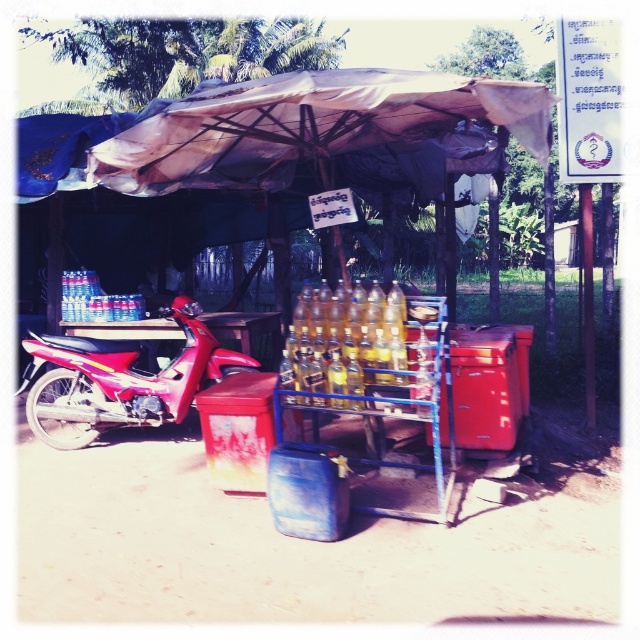
You are a customer approaching the stall and want to reach the metallic blue cart at center to buy something. However, there is a metallic red motorcycle at left blocking your path. Can you walk around the motorcycle to reach the cart?

The metallic blue cart at center is closer to the viewer than the metallic red motorcycle at left, so you can walk around the motorcycle to reach the cart.

You are standing in front of the stall and want to place a small item on the nearest point between point (344, 358) and point (86, 410). Which point should you choose?

Point (344, 358) is closer to the camera than point (86, 410), so you should choose point (344, 358) to place the item.

You are a customer at the stall and want to pick up the yellow glass bottles at center. Which direction should you move from the metallic red motorcycle at left to reach them?

The yellow glass bottles at center are to the right of the metallic red motorcycle at left, so you should move to the right from the metallic red motorcycle at left to reach them.